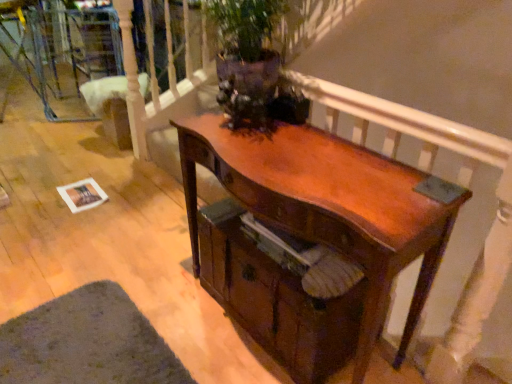
Image resolution: width=512 pixels, height=384 pixels. Identify the location of vacant space to the left of shiny brown wood desk at center. (162, 292).